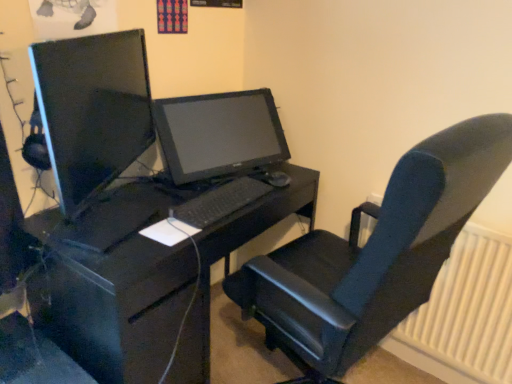
Question: Could you tell me if black matte desk at center is facing velvet-like black chair at center?

Choices:
 (A) yes
 (B) no

Answer: (A)

Question: Considering the relative positions of black matte desk at center and velvet-like black chair at center in the image provided, is black matte desk at center to the left of velvet-like black chair at center from the viewer's perspective?

Choices:
 (A) no
 (B) yes

Answer: (B)

Question: Is black matte desk at center directly adjacent to velvet-like black chair at center?

Choices:
 (A) no
 (B) yes

Answer: (A)

Question: From a real-world perspective, is black matte desk at center below velvet-like black chair at center?

Choices:
 (A) yes
 (B) no

Answer: (A)

Question: Is black matte desk at center positioned with its back to velvet-like black chair at center?

Choices:
 (A) no
 (B) yes

Answer: (A)

Question: Does black matte desk at center appear on the right side of velvet-like black chair at center?

Choices:
 (A) yes
 (B) no

Answer: (B)

Question: Is matte black monitor at left in front of white plastic radiator at right?

Choices:
 (A) no
 (B) yes

Answer: (B)

Question: Is matte black monitor at left looking in the opposite direction of white plastic radiator at right?

Choices:
 (A) no
 (B) yes

Answer: (A)

Question: Is matte black monitor at left smaller than white plastic radiator at right?

Choices:
 (A) no
 (B) yes

Answer: (A)

Question: Is matte black monitor at left completely or partially outside of white plastic radiator at right?

Choices:
 (A) no
 (B) yes

Answer: (B)

Question: Is matte black monitor at left oriented towards white plastic radiator at right?

Choices:
 (A) yes
 (B) no

Answer: (A)

Question: Does matte black monitor at left appear on the right side of white plastic radiator at right?

Choices:
 (A) yes
 (B) no

Answer: (B)

Question: From a real-world perspective, is matte black monitor at left under velvet-like black chair at center?

Choices:
 (A) yes
 (B) no

Answer: (B)